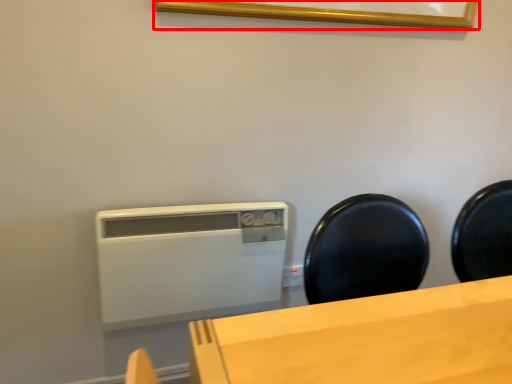
Question: Observing the image, what is the correct spatial positioning of picture frame (annotated by the red box) in reference to home appliance?

Choices:
 (A) left
 (B) right

Answer: (B)